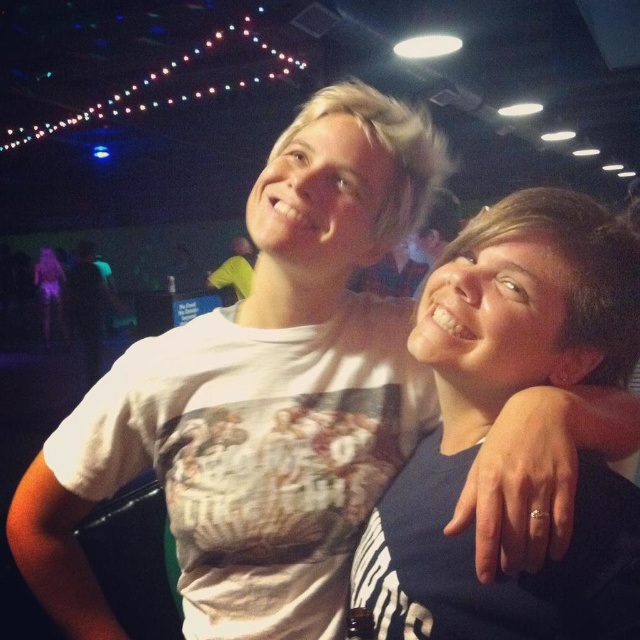
Question: Which of the following is the farthest from the observer?

Choices:
 (A) dark green shirt at left
 (B) yellow t-shirt at center
 (C) dark blue shirt at center

Answer: (A)

Question: Considering the real-world distances, which object is farthest from the yellow t-shirt at center?

Choices:
 (A) dark blue shirt at center
 (B) matte white t-shirt at center
 (C) dark green shirt at left

Answer: (A)

Question: Is matte white t-shirt at center wider than yellow t-shirt at center?

Choices:
 (A) yes
 (B) no

Answer: (A)

Question: Is dark green shirt at left smaller than yellow t-shirt at center?

Choices:
 (A) yes
 (B) no

Answer: (B)

Question: Which point is farther to the camera?

Choices:
 (A) (532, 332)
 (B) (52, 275)
 (C) (234, 253)

Answer: (B)

Question: Is dark green shirt at left smaller than matte white t-shirt at center?

Choices:
 (A) yes
 (B) no

Answer: (B)